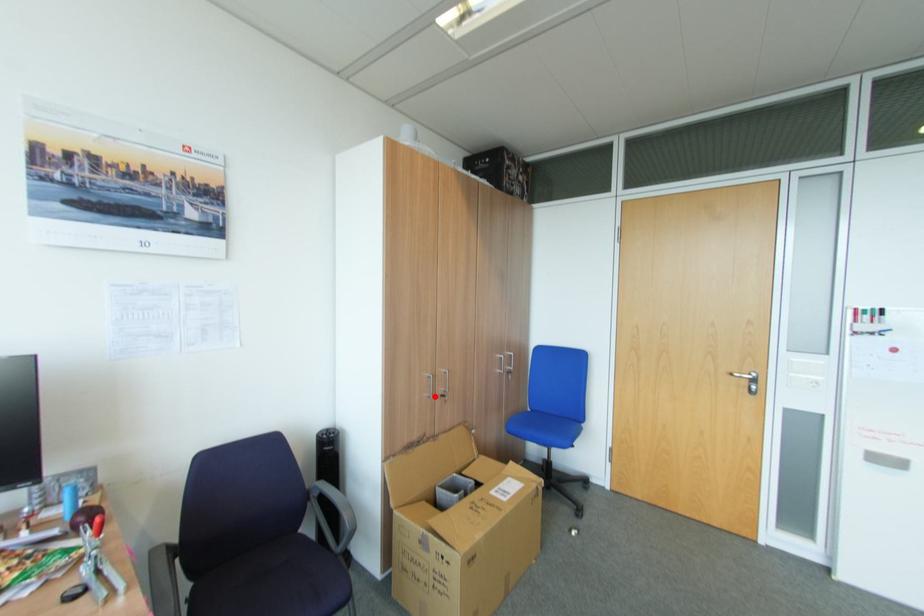
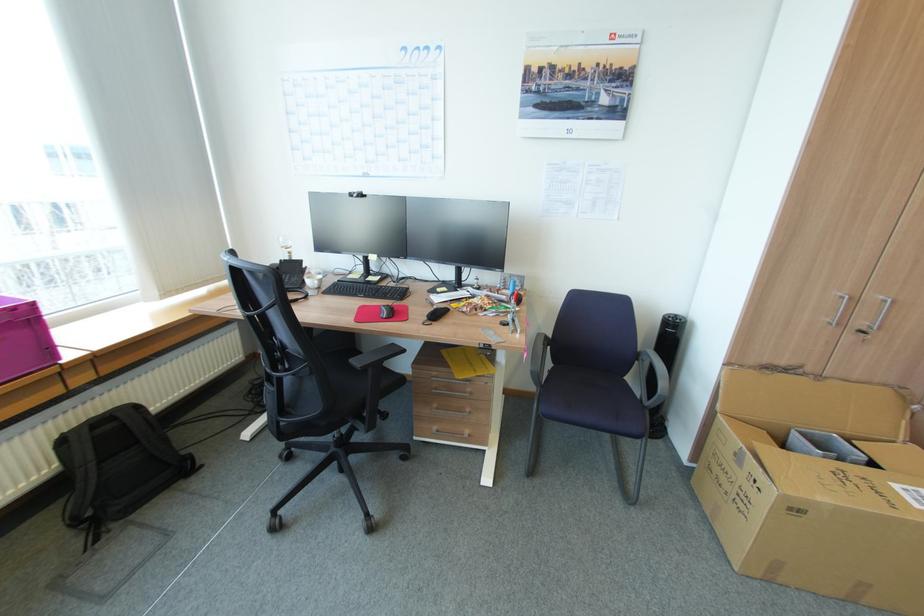
Question: A red point is marked in image1. In image2, is the corresponding 3D point closer to the camera or farther? Reply with the corresponding letter.

Choices:
 (A) The corresponding 3D point is closer.
 (B) The corresponding 3D point is farther.

Answer: (A)